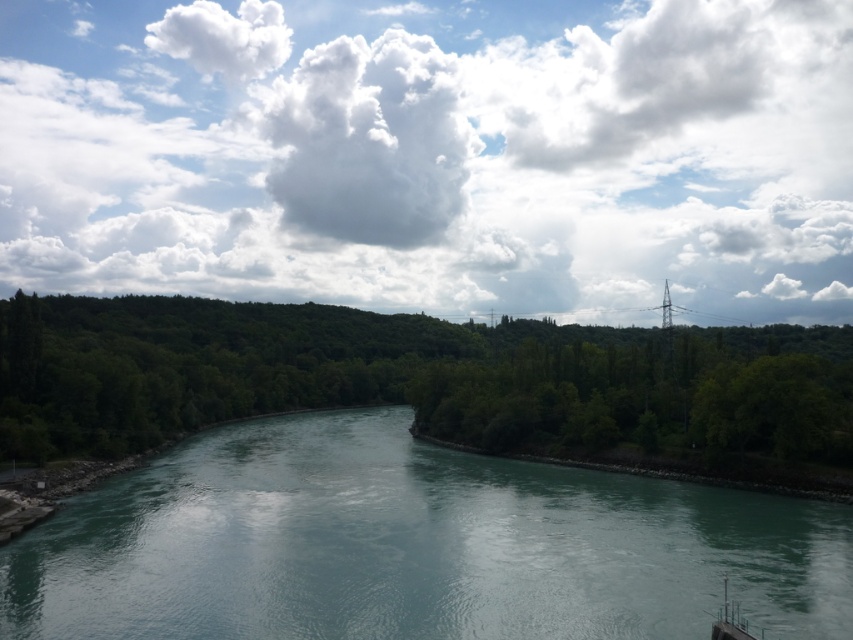
You are a kayaker preparing to paddle down the river. You see the teal smooth water at center and the green leafy trees at left. Which object is closer to you as you start your journey?

The teal smooth water at center is closer to you because it is positioned in front of the green leafy trees at left, meaning the water is nearer to your starting point.

You are an airplane pilot flying over the river scene. You notice the white fluffy cloud at upper center and the green leafy trees at left. Which object is higher in the sky?

The white fluffy cloud at upper center is higher in the sky than the green leafy trees at left because the cloud has a greater height compared to the trees.